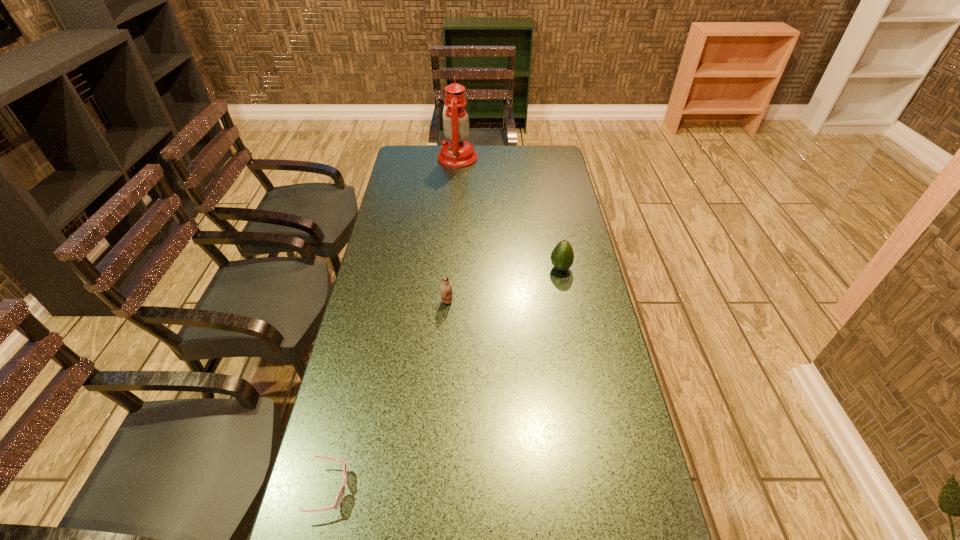
Image resolution: width=960 pixels, height=540 pixels. I want to click on unoccupied area between the third farthest object and the nearest object, so [x=389, y=395].

The image size is (960, 540). In order to click on free spot between the chocolate milk and the farthest object in this screenshot , I will do `click(452, 230)`.

I want to click on vacant area that lies between the oil lamp and the sunglasses, so click(x=394, y=323).

Locate an element on the screen. unoccupied area between the third farthest object and the nearest object is located at coordinates (389, 395).

I want to click on free space between the tallest object and the sunglasses, so click(x=394, y=323).

Where is `object identified as the second closest to the chocolate milk`? This screenshot has width=960, height=540. object identified as the second closest to the chocolate milk is located at coordinates (339, 498).

Find the location of a particular element. object that stands as the closest to the second farthest object is located at coordinates (446, 288).

Image resolution: width=960 pixels, height=540 pixels. Find the location of `free space that satisfies the following two spatial constraints: 1. on the back side of the third farthest object; 2. on the right side of the second farthest object`. free space that satisfies the following two spatial constraints: 1. on the back side of the third farthest object; 2. on the right side of the second farthest object is located at coordinates (449, 268).

Locate an element on the screen. This screenshot has height=540, width=960. free spot that satisfies the following two spatial constraints: 1. on the front side of the avocado; 2. on the left side of the farthest object is located at coordinates (449, 268).